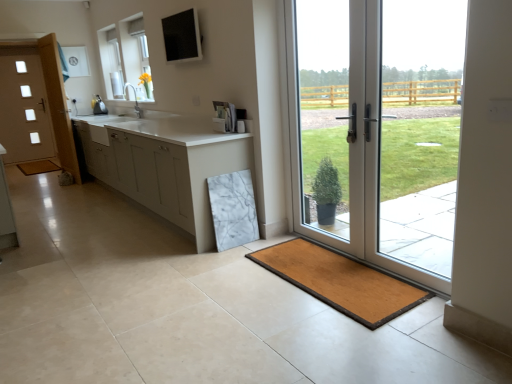
Find the location of a particular element. The image size is (512, 384). vacant space in front of brown rubber bath mat at lower right, placed as the first bath mat when sorted from bottom to top is located at coordinates (329, 340).